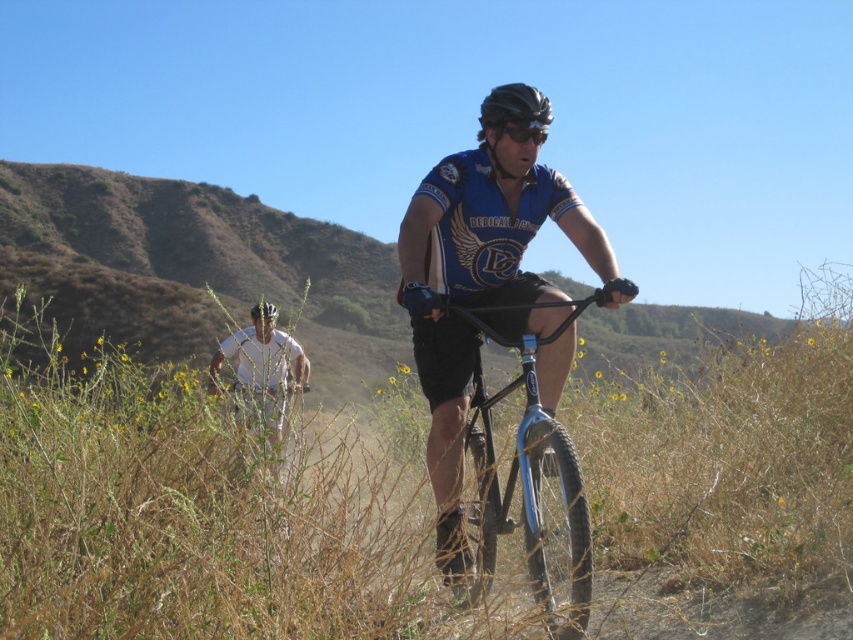
Can you confirm if shiny blue frame at center is bigger than black matte helmet at center?

Correct, shiny blue frame at center is larger in size than black matte helmet at center.

Who is positioned more to the left, shiny blue frame at center or black matte helmet at center?

black matte helmet at center

Who is more distant from viewer, (527, 566) or (509, 108)?

The point (509, 108) is behind.

Find the location of a particular element. The width and height of the screenshot is (853, 640). shiny blue frame at center is located at coordinates (531, 480).

Between black matte helmet at center and white matte bicycle helmet at center, which one appears on the left side from the viewer's perspective?

Positioned to the left is white matte bicycle helmet at center.

Which is in front, point (534, 116) or point (254, 310)?

Point (534, 116) is in front.

Based on the photo, who is more forward, (498, 90) or (254, 314)?

Point (498, 90)

The image size is (853, 640). Identify the location of black matte helmet at center. (514, 108).

Between white matte shirt at center and black matte helmet at center, which one has more height?

white matte shirt at center is taller.

Is white matte shirt at center above black matte helmet at center?

Incorrect, white matte shirt at center is not positioned above black matte helmet at center.

Is point (303, 376) farther from viewer compared to point (511, 92)?

Yes, it is.

Find the location of `white matte shirt at center`. white matte shirt at center is located at coordinates (262, 376).